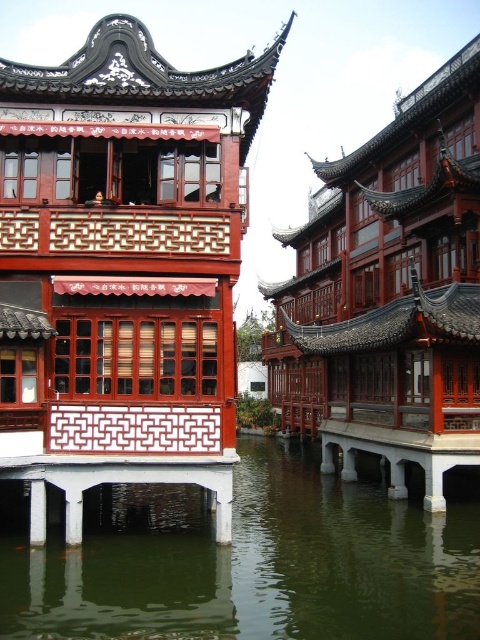
Where is `matte wood palace at center`? The image size is (480, 640). matte wood palace at center is located at coordinates (123, 262).

Measure the distance between matte wood palace at center and camera.

matte wood palace at center and camera are 34.43 meters apart.

At what (x,y) coordinates should I click in order to perform the action: click on matte wood palace at center. Please return your answer as a coordinate pair (x, y). This screenshot has width=480, height=640. Looking at the image, I should click on (123, 262).

Where is `polished wood palace at center`? The height and width of the screenshot is (640, 480). polished wood palace at center is located at coordinates (389, 292).

Which of these two, polished wood palace at center or white glossy pillar at lower left, stands shorter?

Standing shorter between the two is white glossy pillar at lower left.

Between point (275, 285) and point (38, 516), which one is positioned in front?

Positioned in front is point (38, 516).

At what (x,y) coordinates should I click in order to perform the action: click on polished wood palace at center. Please return your answer as a coordinate pair (x, y). Looking at the image, I should click on (389, 292).

Which is more to the left, white glossy pillar at lower left or white glossy pillar at lower center?

white glossy pillar at lower left

Who is more distant from viewer, (36, 538) or (75, 490)?

Point (75, 490)

What are the coordinates of `white glossy pillar at lower left` in the screenshot? It's located at (37, 513).